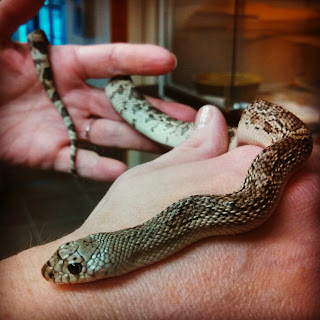
Locate an element on the screen. Image resolution: width=320 pixels, height=320 pixels. ground/floor covered in square dark colored tiles is located at coordinates (63, 209), (55, 228), (15, 236), (14, 222), (31, 186), (85, 185), (97, 195), (9, 193).